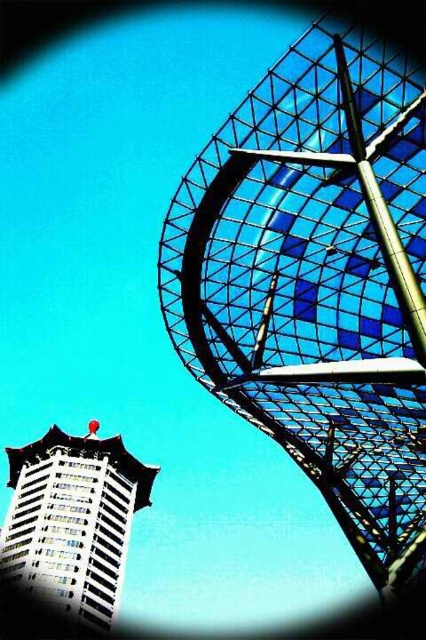
You are standing in front of the two structures and want to determine which point is nearer to you. The first point is located at coordinates point (x=213, y=371) and the second at point (x=77, y=598). Which point is closer to your position?

Point (x=213, y=371) is closer to the viewer than point (x=77, y=598), so the first point is nearer to you.

You are an architect analyzing the spatial relationship between the transparent glass tower at upper right and the white glossy building at lower left. Based on the scene, which of the two structures is closer to the viewer?

The white glossy building at lower left is closer to the viewer because it is larger in size compared to the transparent glass tower at upper right, as size is an indicator of distance in perspective.

You are a drone operator tasked with flying a drone between the transparent glass tower at upper right and the white glossy building at lower left. The drone has a maximum flight range of 200 feet. Can the drone safely make the trip between these two structures without needing to recharge?

The transparent glass tower at upper right and white glossy building at lower left are 240.42 feet apart. Since the distance exceeds the drone s maximum flight range of 200 feet, the drone cannot safely make the trip without recharging.